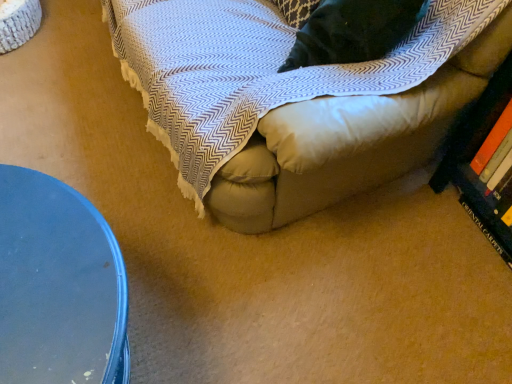
What do you see at coordinates (492, 145) in the screenshot? I see `orange hardcover book at right` at bounding box center [492, 145].

Where is `orange hardcover book at right`? orange hardcover book at right is located at coordinates (492, 145).

Where is `orange hardcover book at right`? This screenshot has height=384, width=512. orange hardcover book at right is located at coordinates (492, 145).